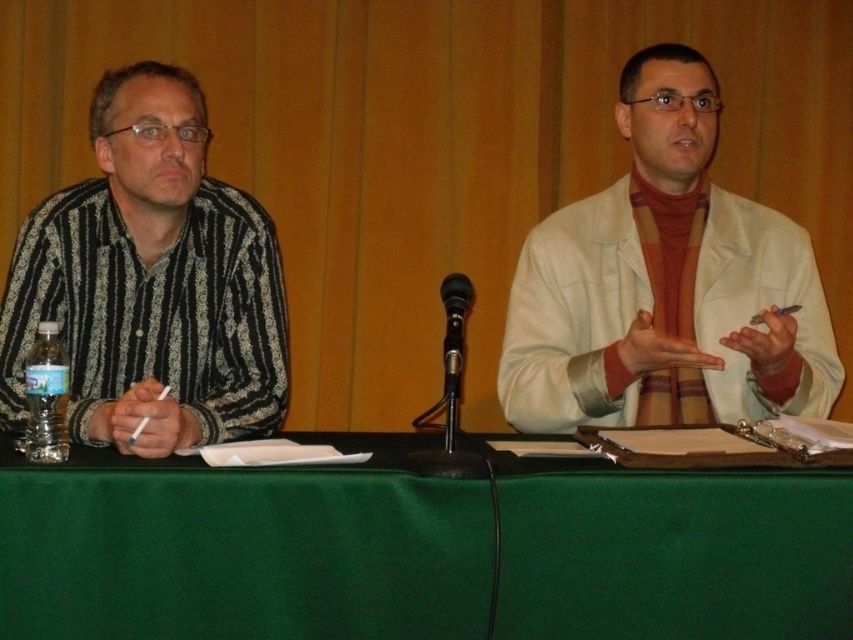
Question: In this image, where is green fabric table at center located relative to black metallic microphone at center?

Choices:
 (A) right
 (B) left

Answer: (B)

Question: Is black striped shirt at left below black metallic microphone at center?

Choices:
 (A) no
 (B) yes

Answer: (A)

Question: Does light beige lab coat at right have a greater width compared to black striped shirt at left?

Choices:
 (A) yes
 (B) no

Answer: (A)

Question: Which object is closer to the camera taking this photo?

Choices:
 (A) green fabric table at center
 (B) black metallic microphone at center
 (C) light beige lab coat at right

Answer: (A)

Question: Based on their relative distances, which object is farther from the green fabric table at center?

Choices:
 (A) black striped shirt at left
 (B) black metallic microphone at center
 (C) light beige lab coat at right

Answer: (C)

Question: Among these points, which one is nearest to the camera?

Choices:
 (A) (450, 369)
 (B) (705, 579)

Answer: (B)